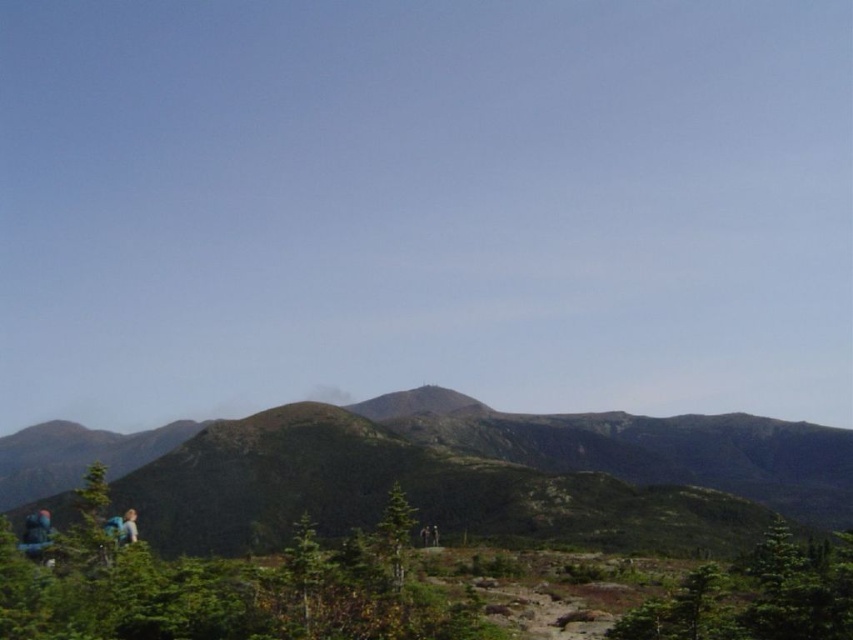
You are a drone operator tasked with capturing aerial footage of the mountainous landscape. You need to ensure that the green grassy hill at center is visible in the frame. Based on its coordinates, where should you position the drone to capture this hill effectively?

The green grassy hill at center is located at point (486, 474), so positioning the drone at this coordinate will ensure the hill is centered in the frame for optimal visibility.